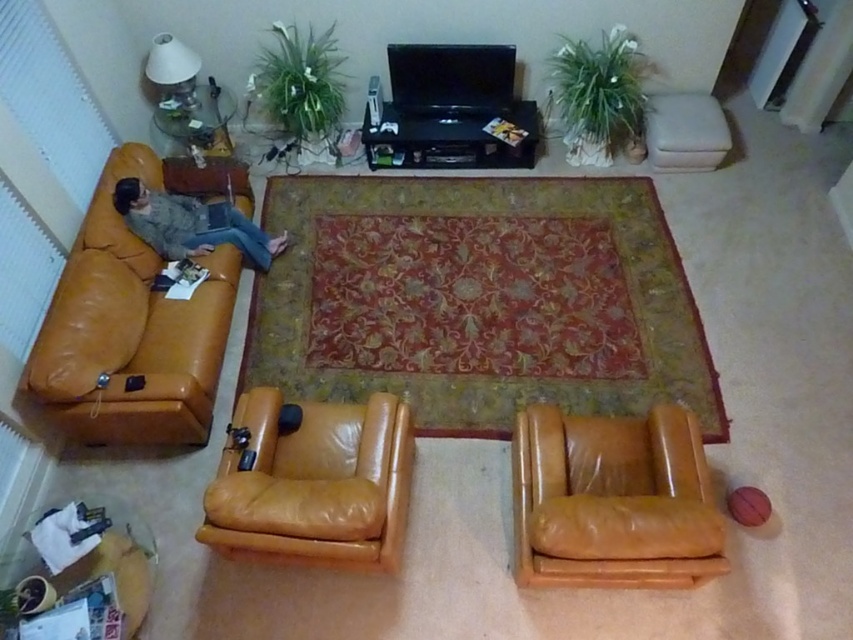
You are a guest entering the living room and want to sit in the closest available seat. The leather couch at left and the matte tan leather armchair at center are both unoccupied. Which seat should you choose to minimize the distance you need to walk?

The leather couch at left is closer because it is in front of the matte tan leather armchair at center, so you should choose the leather couch at left to minimize the distance you need to walk.